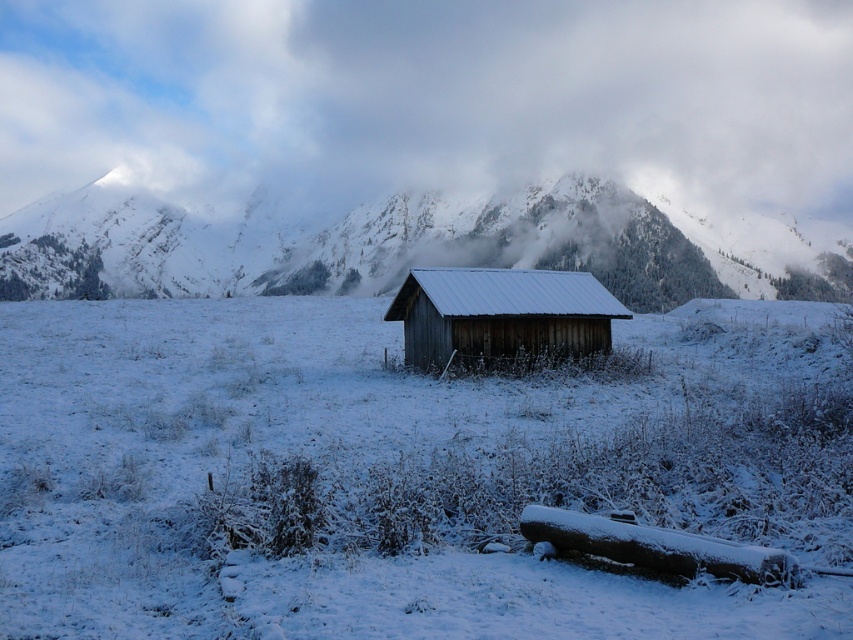
You are standing in front of the wooden shed and looking at two points marked in the image. Which point, point (666, 211) or point (428, 298), is closer to you?

Point (428, 298) is closer to you because it is less further to the camera than point (666, 211).

You are planning to build a snowman using the snow from the snowy wooden mountain at center and the white fluffy cloud at upper center. Which object provides more snow for the snowman?

The white fluffy cloud at upper center has a greater width than the snowy wooden mountain at center, so it provides more snow for the snowman.